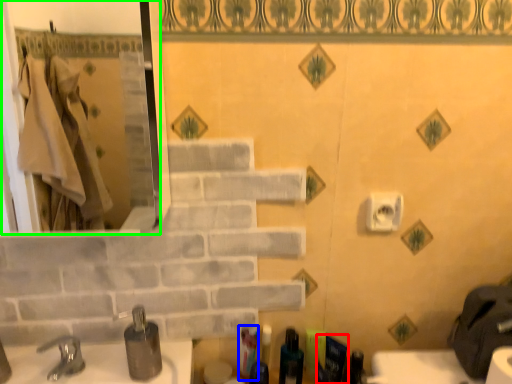
Question: Which object is positioned closest to toiletry (highlighted by a red box)? Select from toiletry (highlighted by a blue box) and mirror (highlighted by a green box).

Choices:
 (A) toiletry
 (B) mirror

Answer: (A)